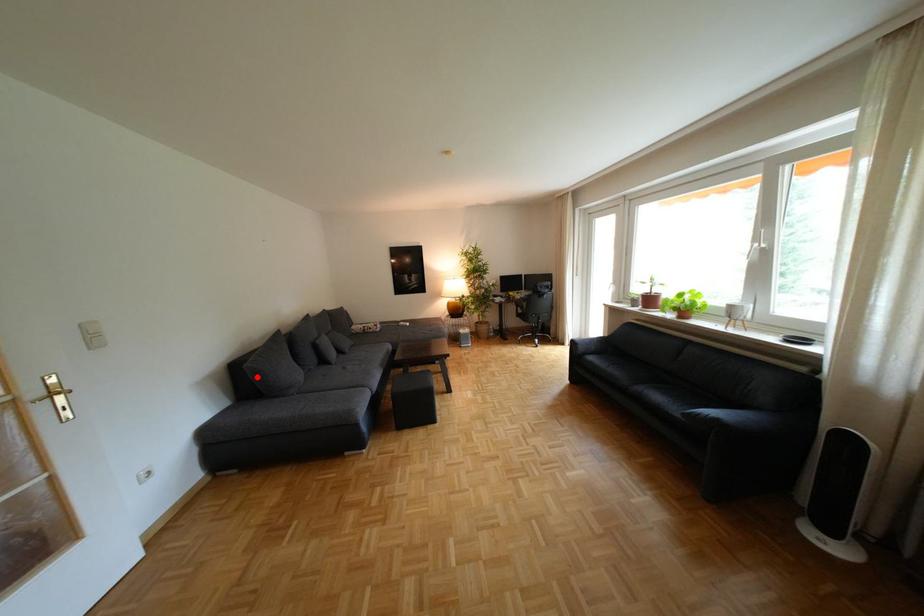
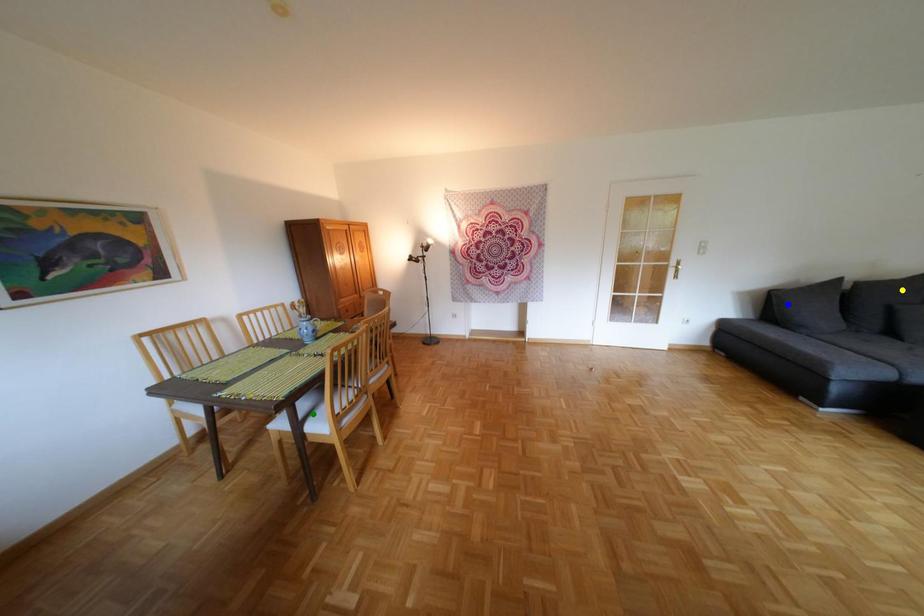
Question: I am providing you with two images of the same scene from different viewpoints. A red point is marked on the first image. You are given multiple points on the second image. Which spot in image 2 lines up with the point in image 1?

Choices:
 (A) blue point
 (B) yellow point
 (C) green point

Answer: (A)